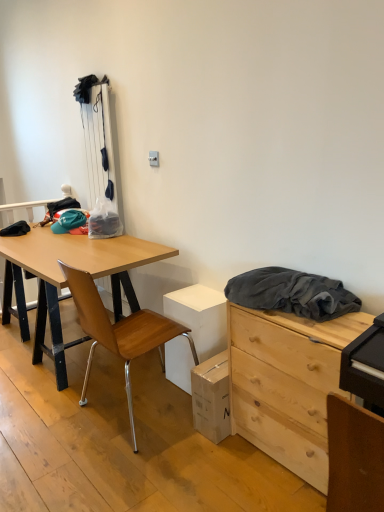
Question: Is natural wood chest of drawers at right at the right side of wooden at left?

Choices:
 (A) no
 (B) yes

Answer: (B)

Question: Is natural wood chest of drawers at right turned away from wooden at left?

Choices:
 (A) no
 (B) yes

Answer: (A)

Question: Is natural wood chest of drawers at right next to wooden at left?

Choices:
 (A) no
 (B) yes

Answer: (A)

Question: Can you confirm if natural wood chest of drawers at right is wider than wooden at left?

Choices:
 (A) yes
 (B) no

Answer: (B)

Question: Does natural wood chest of drawers at right come in front of wooden at left?

Choices:
 (A) yes
 (B) no

Answer: (A)

Question: Does natural wood chest of drawers at right have a smaller size compared to wooden at left?

Choices:
 (A) yes
 (B) no

Answer: (A)

Question: Can you confirm if dark gray fabric at upper right is smaller than wooden at left?

Choices:
 (A) no
 (B) yes

Answer: (B)

Question: Does dark gray fabric at upper right have a lesser height compared to wooden at left?

Choices:
 (A) yes
 (B) no

Answer: (A)

Question: From the image's perspective, is dark gray fabric at upper right on top of wooden at left?

Choices:
 (A) no
 (B) yes

Answer: (B)

Question: Is dark gray fabric at upper right to the right of wooden at left from the viewer's perspective?

Choices:
 (A) no
 (B) yes

Answer: (B)

Question: Is dark gray fabric at upper right touching wooden at left?

Choices:
 (A) no
 (B) yes

Answer: (A)

Question: From the image's perspective, is dark gray fabric at upper right beneath wooden at left?

Choices:
 (A) yes
 (B) no

Answer: (B)

Question: Is the depth of wooden at left less than that of natural wood chest of drawers at right?

Choices:
 (A) yes
 (B) no

Answer: (B)